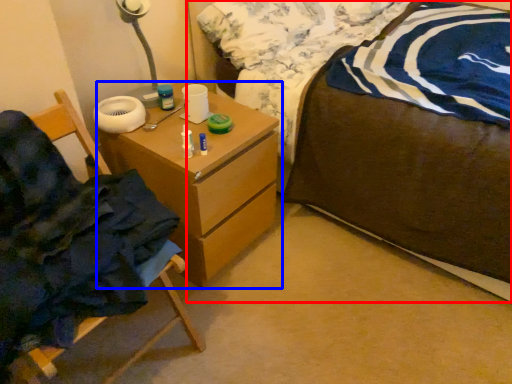
Question: Which object appears closest to the camera in this image, bed (highlighted by a red box) or chest of drawers (highlighted by a blue box)?

Choices:
 (A) bed
 (B) chest of drawers

Answer: (A)